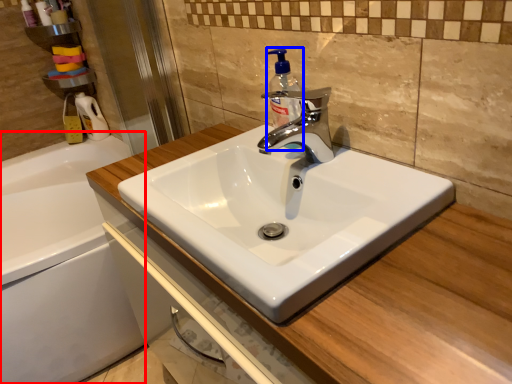
Question: Which point is closer to the camera, bath (highlighted by a red box) or soap dispenser (highlighted by a blue box)?

Choices:
 (A) bath
 (B) soap dispenser

Answer: (B)